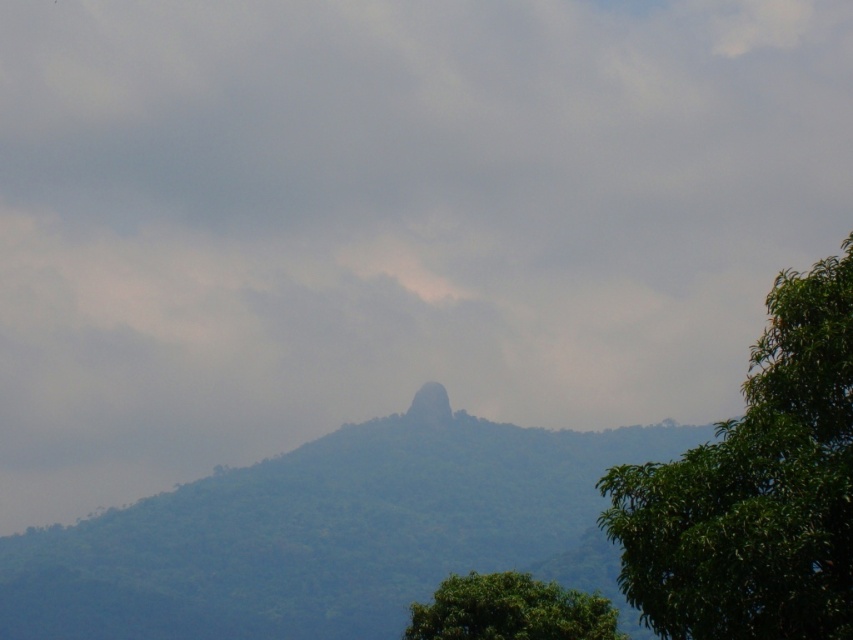
You are hiking and see the green leafy tree at right and the green leafy tree at lower right. Which tree is closer to you?

The green leafy tree at right is closer to you because it is in front of the green leafy tree at lower right.

You are a hiker who wants to take a photo of the green leafy mountain at center. Where should you position yourself to capture the mountain in the center of your camera frame?

To capture the green leafy mountain at center in the center of your camera frame, position yourself directly in front of the mountain at its 2D location coordinates of point (329,534).